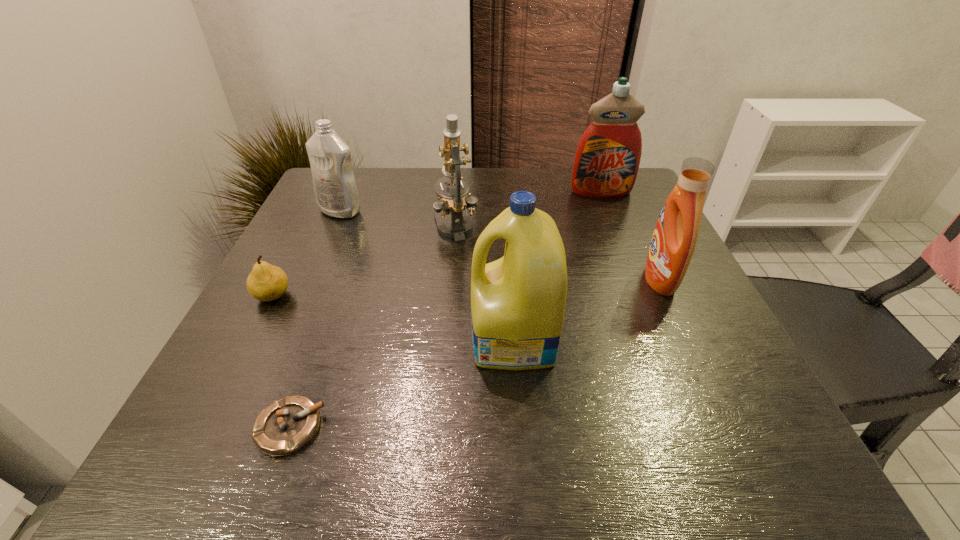
At what (x,y) coordinates should I click in order to perform the action: click on the farthest object. Please return your answer as a coordinate pair (x, y). The height and width of the screenshot is (540, 960). Looking at the image, I should click on (607, 159).

Find the location of `the second detergent from left to right`. the second detergent from left to right is located at coordinates (518, 302).

The height and width of the screenshot is (540, 960). I want to click on the nearest detergent, so click(518, 302).

Where is `microscope`? The width and height of the screenshot is (960, 540). microscope is located at coordinates (455, 201).

Identify the location of the third farthest detergent. (674, 239).

Find the location of a particular element. the leftmost detergent is located at coordinates (335, 188).

What are the coordinates of `pear` in the screenshot? It's located at (266, 282).

This screenshot has height=540, width=960. Find the location of `ashtray`. ashtray is located at coordinates (284, 427).

Where is `the shortest object`? the shortest object is located at coordinates (284, 427).

Image resolution: width=960 pixels, height=540 pixels. Find the location of `vacant area situated 0.100m on the front surface of the farthest detergent`. vacant area situated 0.100m on the front surface of the farthest detergent is located at coordinates (612, 220).